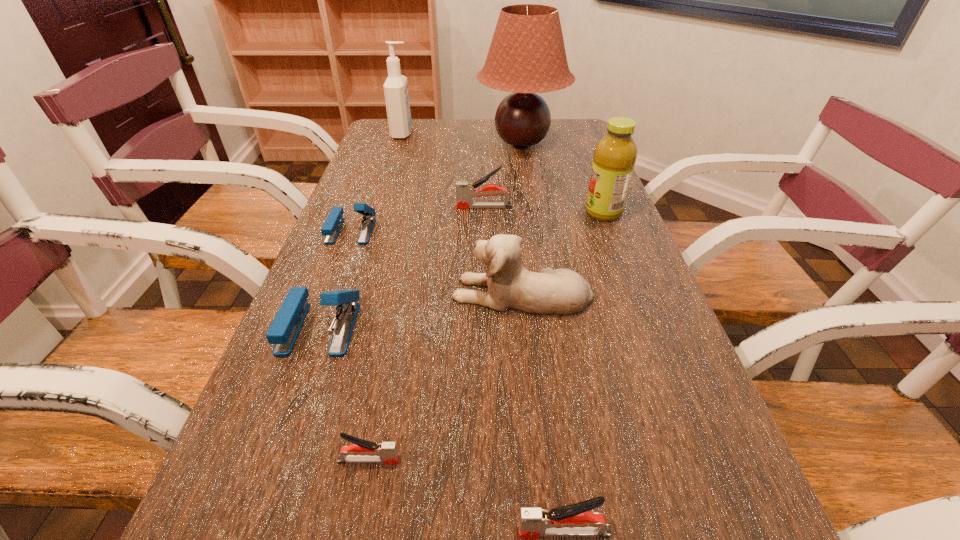
The width and height of the screenshot is (960, 540). I want to click on free area in between the smallest gray stapler and the brown lampshade, so click(x=445, y=301).

Locate an element on the screen. Image resolution: width=960 pixels, height=540 pixels. unoccupied position between the fourth tallest object and the bigger blue stapler is located at coordinates (420, 310).

At what (x,y) coordinates should I click in order to perform the action: click on free space between the farthest gray stapler and the lampshade. Please return your answer as a coordinate pair (x, y). Looking at the image, I should click on (503, 174).

I want to click on the seventh closest object to the white puppy, so click(527, 55).

Where is `object that is the seventh closest to the second tallest object`? The height and width of the screenshot is (540, 960). object that is the seventh closest to the second tallest object is located at coordinates (362, 451).

Identify which stapler is the fourth nearest to the farther blue stapler. Please provide its 2D coordinates. Your answer should be formatted as a tuple, i.e. [(x, y)], where the tuple contains the x and y coordinates of a point satisfying the conditions above.

[(573, 520)]

Find the location of a particular element. Image resolution: width=960 pixels, height=540 pixels. stapler that is the third closest to the fruit juice is located at coordinates (283, 332).

I want to click on gray stapler that is the second closest one to the cleansing agent, so click(x=362, y=451).

Identify which gray stapler is the closest to the third stapler from left to right. Please provide its 2D coordinates. Your answer should be formatted as a tuple, i.e. [(x, y)], where the tuple contains the x and y coordinates of a point satisfying the conditions above.

[(573, 520)]

Identify which blue stapler is the closest to the sixth shortest object. Please provide its 2D coordinates. Your answer should be formatted as a tuple, i.e. [(x, y)], where the tuple contains the x and y coordinates of a point satisfying the conditions above.

[(283, 332)]